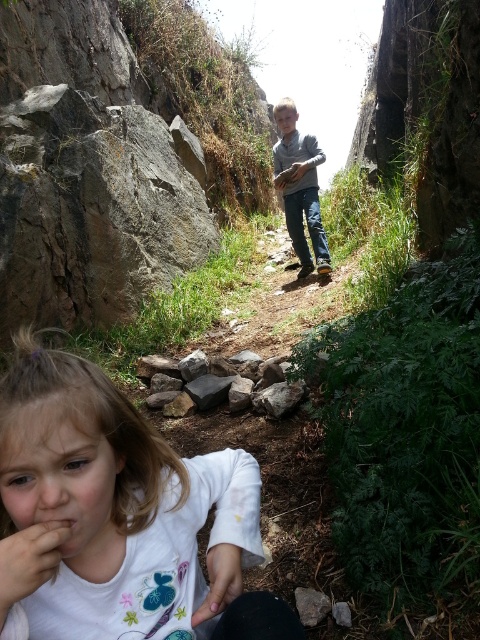
You are a hiker who has just reached the edge of the path. You notice a smooth skin hand at lower left and a brown rough rock at lower center. Which object is closer to you as you stand at the edge?

The smooth skin hand at lower left is closer to you because it is in front of the brown rough rock at lower center.

You are a hiker who has just reached the viewpoint overlooking the valley. You see the white soft shirt at lower left and the smooth skin hand at lower left in the scene. Which object appears taller in the image?

The white soft shirt at lower left appears taller than the smooth skin hand at lower left in the image.

You are a hiker who has just reached the edge of the path. You notice the brown rough rock at lower center and the smooth skin hand at center. Which object is closer to your current position?

The brown rough rock at lower center is closer to your current position because it is below the smooth skin hand at center, indicating it is positioned lower and nearer to the hiker.